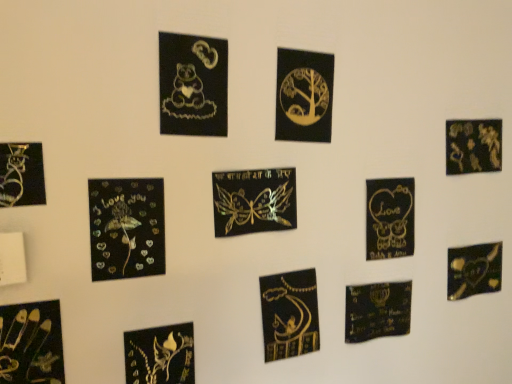
Question: Relative to gold metallic tree at upper center, which ranks as the third picture frame in right-to-left order, is matte black heart at lower center, the 1th embroidery from the back, in front or behind?

Choices:
 (A) behind
 (B) front

Answer: (A)

Question: Based on their positions, is matte black heart at lower center, the 2th embroidery when ordered from front to back, located to the left or right of gold metallic tree at upper center, which ranks as the third picture frame in right-to-left order?

Choices:
 (A) right
 (B) left

Answer: (A)

Question: Which object is the closest to the gold metallic tree at upper center, which ranks as the third picture frame in right-to-left order?

Choices:
 (A) matte black butterfly at lower left, which appears as the ninth picture frame when viewed from the right
 (B) matte black heart at lower center, the 1th embroidery from the back
 (C) matte gold bear at upper center, the 5th picture frame viewed from the left
 (D) metallic gold butterfly at lower left, the 6th picture frame from the right
 (E) metallic gold scissors at bottom left, positioned as the 2th picture frame in left-to-right order

Answer: (C)

Question: Considering the real-world distances, which object is closest to the metallic gold heart at bottom right?

Choices:
 (A) gold metallic calligraphy at center, the second embroidery from the back
 (B) gold metallic flower at center left, the seventh picture frame from the right
 (C) gold metallic heart at center right, placed as the 8th picture frame when sorted from left to right
 (D) matte black heart at lower center, placed as the second embroidery when sorted from left to right
 (E) metallic gold scissors at bottom left, the 8th picture frame positioned from the right

Answer: (D)